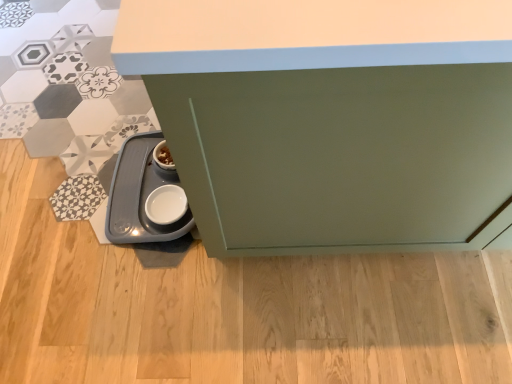
Locate an element on the screen. Image resolution: width=512 pixels, height=384 pixels. free space to the back side of white glossy pet feeder at lower left is located at coordinates (111, 112).